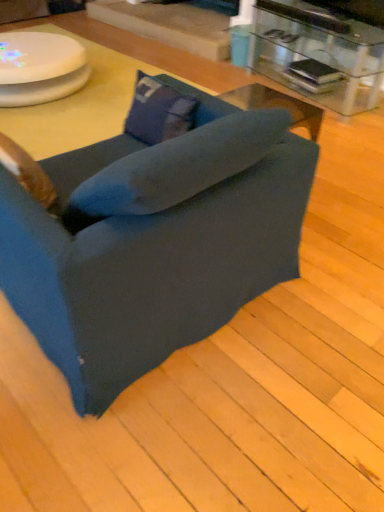
Question: Is blue fabric pillow at center located within white glossy round table at upper left?

Choices:
 (A) no
 (B) yes

Answer: (A)

Question: From a real-world perspective, is white glossy round table at upper left positioned under blue fabric pillow at center based on gravity?

Choices:
 (A) no
 (B) yes

Answer: (B)

Question: From a real-world perspective, is white glossy round table at upper left over blue fabric pillow at center?

Choices:
 (A) no
 (B) yes

Answer: (A)

Question: Is white glossy round table at upper left positioned with its back to blue fabric pillow at center?

Choices:
 (A) no
 (B) yes

Answer: (A)

Question: Does white glossy round table at upper left appear on the right side of blue fabric pillow at center?

Choices:
 (A) yes
 (B) no

Answer: (B)

Question: Visually, is blue fabric pillow at center positioned to the left or to the right of white glossy round table at upper left?

Choices:
 (A) right
 (B) left

Answer: (A)

Question: Considering the positions of blue fabric pillow at center and white glossy round table at upper left in the image, is blue fabric pillow at center bigger or smaller than white glossy round table at upper left?

Choices:
 (A) big
 (B) small

Answer: (B)

Question: In terms of width, does blue fabric pillow at center look wider or thinner when compared to white glossy round table at upper left?

Choices:
 (A) wide
 (B) thin

Answer: (B)

Question: From the image's perspective, relative to white glossy round table at upper left, is blue fabric pillow at center above or below?

Choices:
 (A) above
 (B) below

Answer: (B)

Question: Looking at the image, does white glossy round table at upper left seem bigger or smaller compared to dark blue fabric chair at center?

Choices:
 (A) small
 (B) big

Answer: (A)

Question: From the image's perspective, is white glossy round table at upper left positioned above or below dark blue fabric chair at center?

Choices:
 (A) below
 (B) above

Answer: (B)

Question: From a real-world perspective, relative to dark blue fabric chair at center, is white glossy round table at upper left vertically above or below?

Choices:
 (A) below
 (B) above

Answer: (A)

Question: Which is correct: white glossy round table at upper left is inside dark blue fabric chair at center, or outside of it?

Choices:
 (A) inside
 (B) outside

Answer: (B)

Question: From a real-world perspective, is blue fabric pillow at center above or below dark blue fabric chair at center?

Choices:
 (A) below
 (B) above

Answer: (B)

Question: Is blue fabric pillow at center to the left or to the right of dark blue fabric chair at center in the image?

Choices:
 (A) right
 (B) left

Answer: (A)